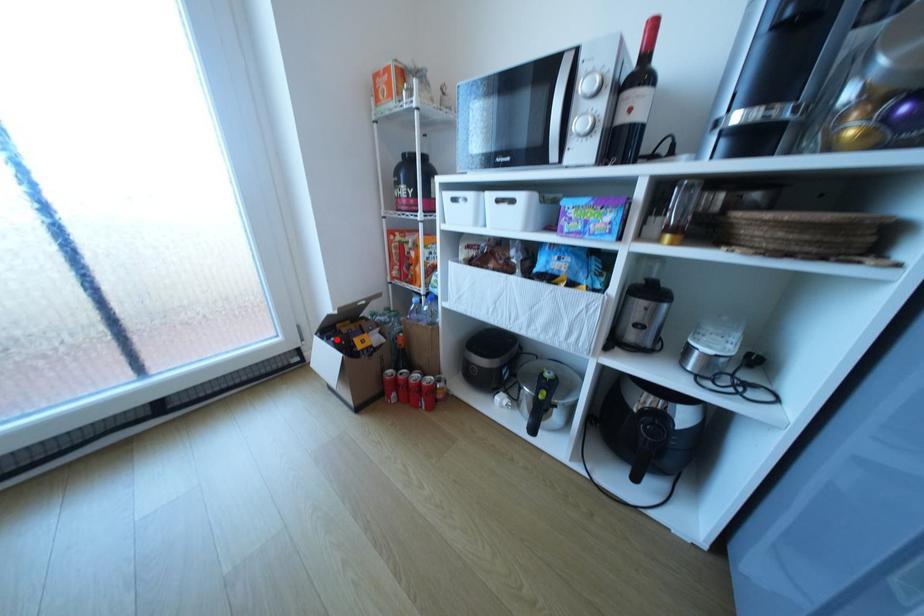
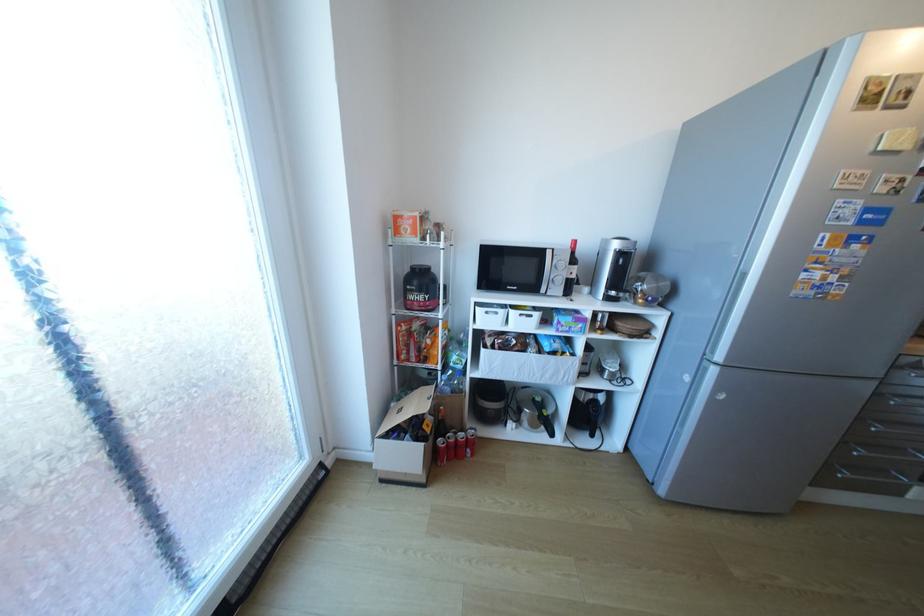
Locate, in the second image, the point that corresponds to the highlighted location in the first image.

(407, 437)